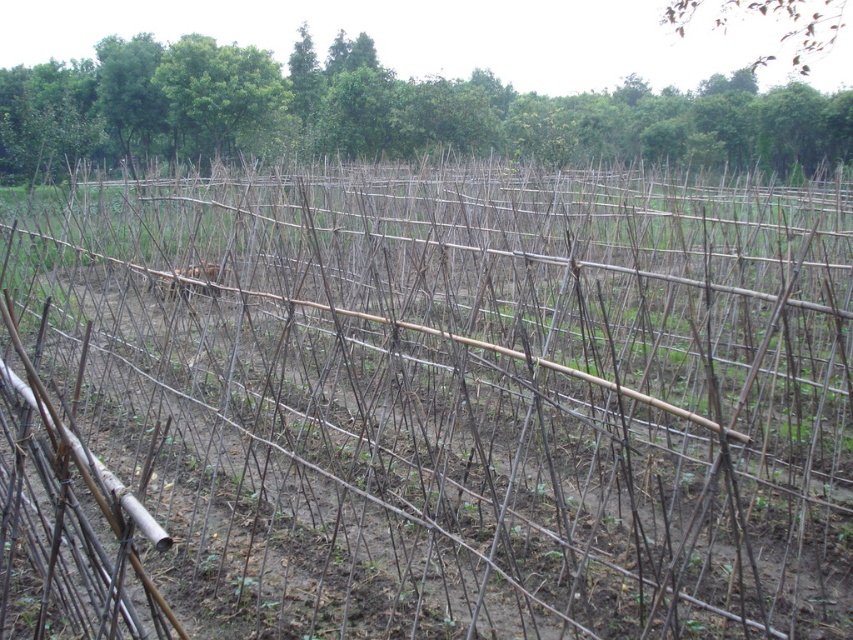
You are a farmer planning to plant new crops between the green leafy tree at upper center and the brown wood tree at upper right. Considering their sizes, which tree will require more space around it to avoid shading your crops?

The brown wood tree at upper right requires more space around it because it is larger than the green leafy tree at upper center, which is smaller in size.

You are a farmer planning to plant a new row of crops between the green leafy tree at upper center and the brown wood tree at upper right. Based on their widths, which tree should you consider as the wider one for spacing your crops appropriately?

The green leafy tree at upper center might be wider than brown wood tree at upper right, so you should consider the green leafy tree at upper center as the wider one for spacing your crops appropriately.

You are a farmer planning to install a fence between the green leafy tree at upper center and the brown wood tree at upper right. The fence posts need to be spaced 2 meters apart. How many fence posts will you need to install a straight fence between them?

The distance between the green leafy tree at upper center and the brown wood tree at upper right is 11.06 meters. To install fence posts spaced 2 meters apart, divide the distance by spacing and add one post for the starting point. 11.06 divided by 2 equals approximately 5.53. Rounding up to 6 intervals requires 7 posts. However, since the last post must align exactly with the end tree, adjust by adding an additional post. Total posts needed are 8.